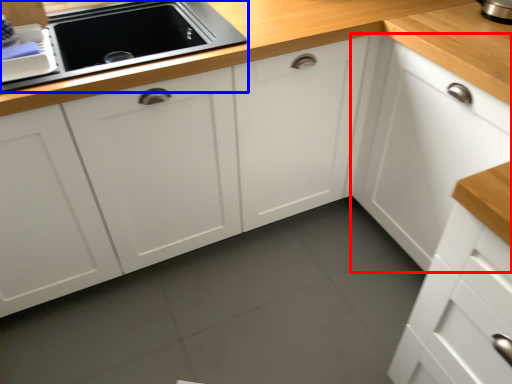
Question: Among these objects, which one is farthest to the camera, cabinetry (highlighted by a red box) or home appliance (highlighted by a blue box)?

Choices:
 (A) cabinetry
 (B) home appliance

Answer: (B)